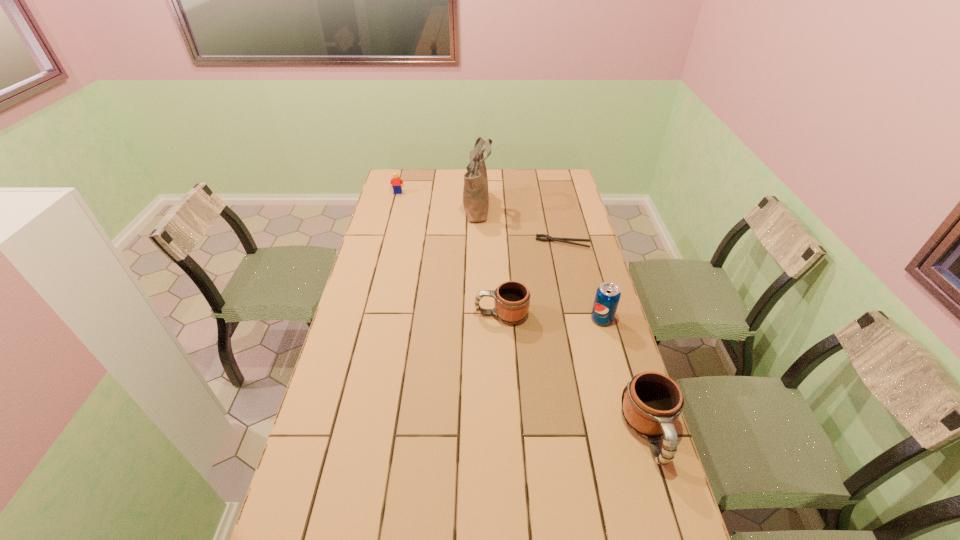
Where is `mug at the right edge`? This screenshot has width=960, height=540. mug at the right edge is located at coordinates (652, 403).

Locate an element on the screen. The image size is (960, 540). tongs that is at the right edge is located at coordinates (548, 238).

Where is `pop soda that is at the right edge`? Image resolution: width=960 pixels, height=540 pixels. pop soda that is at the right edge is located at coordinates (608, 294).

Identify the location of object that is at the far left corner. The width and height of the screenshot is (960, 540). (396, 181).

In the image, there is a desktop. Identify the location of free space at the far edge. (426, 169).

The image size is (960, 540). In order to click on vacant position at the near edge of the desktop in this screenshot , I will do `click(400, 532)`.

Locate an element on the screen. The width and height of the screenshot is (960, 540). vacant space at the left edge of the desktop is located at coordinates (383, 200).

This screenshot has height=540, width=960. In the image, there is a desktop. Identify the location of free space at the right edge. (561, 237).

This screenshot has width=960, height=540. In the image, there is a desktop. In order to click on vacant space at the near left corner in this screenshot , I will do `click(349, 535)`.

At what (x,y) coordinates should I click in order to perform the action: click on free space at the far right corner of the desktop. Please return your answer as a coordinate pair (x, y). The image size is (960, 540). Looking at the image, I should click on (540, 170).